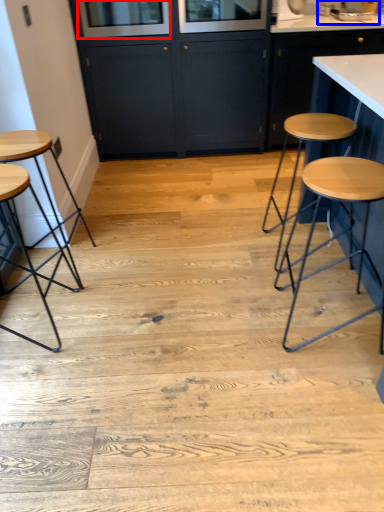
Question: Which object is further to the camera taking this photo, window screen (highlighted by a red box) or sink (highlighted by a blue box)?

Choices:
 (A) window screen
 (B) sink

Answer: (B)